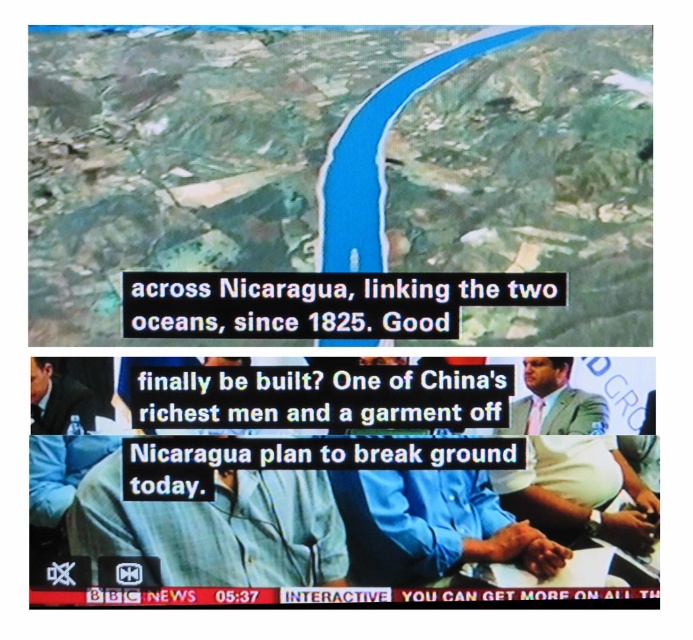
Question: Which point is farther to the camera?

Choices:
 (A) (532, 417)
 (B) (44, 413)

Answer: (A)

Question: Can you confirm if light blue suit at right is smaller than light blue shirt at left?

Choices:
 (A) yes
 (B) no

Answer: (B)

Question: Where is light blue suit at right located in relation to light blue shirt at left in the image?

Choices:
 (A) right
 (B) left

Answer: (A)

Question: Which point is farther from the camera taking this photo?

Choices:
 (A) (30, 420)
 (B) (532, 403)

Answer: (B)

Question: Where is light blue suit at right located in relation to light blue shirt at left in the image?

Choices:
 (A) left
 (B) right

Answer: (B)

Question: Which object appears closest to the camera in this image?

Choices:
 (A) light blue shirt at left
 (B) light blue suit at right

Answer: (A)